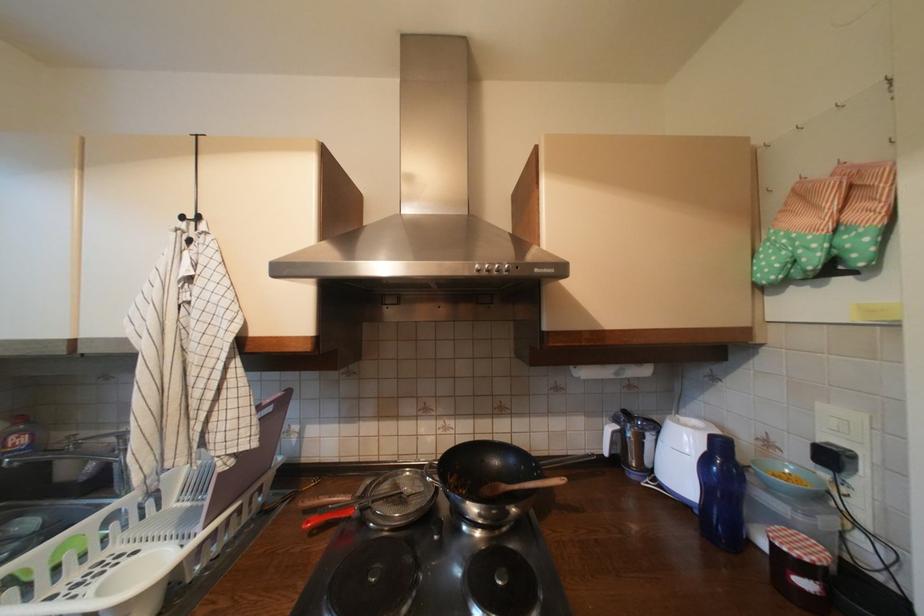
This screenshot has width=924, height=616. Identify the location of wooden spoon. (521, 485).